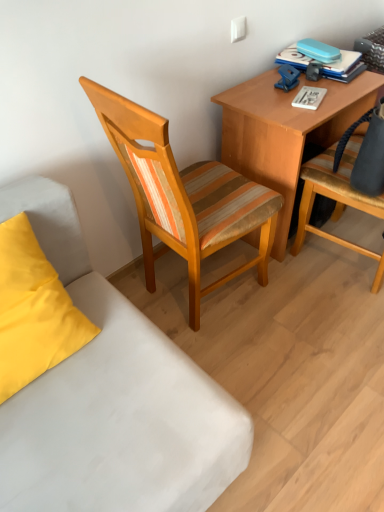
Identify the location of woodenchair at center, marked as the second chair in a right-to-left arrangement. (184, 196).

What do you see at coordinates (112, 398) in the screenshot? I see `white fabric couch at lower left` at bounding box center [112, 398].

Measure the distance between white fabric couch at lower left and camera.

white fabric couch at lower left and camera are 35.54 inches apart from each other.

What are the coordinates of `blue hardcover book at upper right` in the screenshot? It's located at (324, 64).

I want to click on matte yellow pillow at lower left, so click(x=33, y=311).

The height and width of the screenshot is (512, 384). What do you see at coordinates (286, 131) in the screenshot?
I see `wooden desk at upper right` at bounding box center [286, 131].

Where is `woodenchair at center, the first chair when ordered from left to right`? woodenchair at center, the first chair when ordered from left to right is located at coordinates (184, 196).

Choose the correct answer: Is matte yellow pillow at lower left inside wooden desk at upper right or outside it?

The correct answer is: outside.

Is wooden desk at upper right at the back of matte yellow pillow at lower left?

No, wooden desk at upper right is not at the back of matte yellow pillow at lower left.

Considering the relative sizes of matte yellow pillow at lower left and wooden desk at upper right in the image provided, is matte yellow pillow at lower left wider than wooden desk at upper right?

In fact, matte yellow pillow at lower left might be narrower than wooden desk at upper right.

Which of these two, blue hardcover book at upper right or white fabric couch at lower left, is thinner?

With smaller width is blue hardcover book at upper right.

Considering the positions of objects blue hardcover book at upper right and white fabric couch at lower left in the image provided, who is more to the right, blue hardcover book at upper right or white fabric couch at lower left?

blue hardcover book at upper right is more to the right.

Is blue hardcover book at upper right smaller than white fabric couch at lower left?

Indeed, blue hardcover book at upper right has a smaller size compared to white fabric couch at lower left.

How far apart are blue hardcover book at upper right and white fabric couch at lower left?

blue hardcover book at upper right is 1.42 meters away from white fabric couch at lower left.

Can you confirm if striped fabric chair at right, placed as the 2th chair when sorted from left to right, is wider than matte yellow pillow at lower left?

Indeed, striped fabric chair at right, placed as the 2th chair when sorted from left to right, has a greater width compared to matte yellow pillow at lower left.

Does point (341, 197) lie behind point (23, 225)?

Yes.

Does striped fabric chair at right, the first chair viewed from the right, appear on the right side of matte yellow pillow at lower left?

Yes, striped fabric chair at right, the first chair viewed from the right, is to the right of matte yellow pillow at lower left.

Between striped fabric chair at right, the first chair viewed from the right, and blue hardcover book at upper right, which one appears on the right side from the viewer's perspective?

striped fabric chair at right, the first chair viewed from the right.

Are striped fabric chair at right, the first chair viewed from the right, and blue hardcover book at upper right making contact?

There is a gap between striped fabric chair at right, the first chair viewed from the right, and blue hardcover book at upper right.

Considering the sizes of objects striped fabric chair at right, the first chair viewed from the right, and blue hardcover book at upper right in the image provided, who is smaller, striped fabric chair at right, the first chair viewed from the right, or blue hardcover book at upper right?

Smaller between the two is blue hardcover book at upper right.

Is the depth of striped fabric chair at right, placed as the 2th chair when sorted from left to right, greater than that of blue hardcover book at upper right?

No, it is in front of blue hardcover book at upper right.

Which is behind, point (272, 115) or point (6, 226)?

Point (272, 115)

Is wooden desk at upper right oriented towards matte yellow pillow at lower left?

No, wooden desk at upper right is not facing towards matte yellow pillow at lower left.

Is wooden desk at upper right at the left side of matte yellow pillow at lower left?

No, wooden desk at upper right is not to the left of matte yellow pillow at lower left.

How many degrees apart are the facing directions of wooden desk at upper right and matte yellow pillow at lower left?

They differ by 3.26 degrees in their facing directions.

You are a GUI agent. You are given a task and a screenshot of the screen. Output one action in this format:
    pyautogui.click(x=<x>, y=<y>)
    Task: Click on the studio couch below the blue hardcover book at upper right (from the image's perspective)
    This screenshot has width=384, height=512.
    Given the screenshot: What is the action you would take?
    pyautogui.click(x=112, y=398)

Is white fabric couch at lower left positioned with its back to blue hardcover book at upper right?

white fabric couch at lower left does not have its back to blue hardcover book at upper right.

Between white fabric couch at lower left and blue hardcover book at upper right, which one appears on the right side from the viewer's perspective?

From the viewer's perspective, blue hardcover book at upper right appears more on the right side.

Considering the relative positions of white fabric couch at lower left and blue hardcover book at upper right in the image provided, is white fabric couch at lower left in front of blue hardcover book at upper right?

Yes, it is in front of blue hardcover book at upper right.

From a real-world perspective, is blue hardcover book at upper right on woodenchair at center, marked as the second chair in a right-to-left arrangement?

Yes, from a real-world perspective, blue hardcover book at upper right is above woodenchair at center, marked as the second chair in a right-to-left arrangement.

Which object is thinner, blue hardcover book at upper right or woodenchair at center, the first chair when ordered from left to right?

Thinner between the two is blue hardcover book at upper right.

How many degrees apart are the facing directions of blue hardcover book at upper right and woodenchair at center, the first chair when ordered from left to right?

The angle between the facing direction of blue hardcover book at upper right and the facing direction of woodenchair at center, the first chair when ordered from left to right, is 79.7 degrees.

Can you confirm if blue hardcover book at upper right is bigger than woodenchair at center, the first chair when ordered from left to right?

Incorrect, blue hardcover book at upper right is not larger than woodenchair at center, the first chair when ordered from left to right.

Identify the location of pillow on the left of the wooden desk at upper right. (33, 311).

This screenshot has width=384, height=512. I want to click on book that is on the right side of white fabric couch at lower left, so click(x=324, y=64).

Estimate the real-world distances between objects in this image. Which object is closer to blue hardcover book at upper right, white fabric couch at lower left or striped fabric chair at right, placed as the 2th chair when sorted from left to right?

striped fabric chair at right, placed as the 2th chair when sorted from left to right, is closer to blue hardcover book at upper right.

Estimate the real-world distances between objects in this image. Which object is further from blue hardcover book at upper right, matte yellow pillow at lower left or wooden desk at upper right?

matte yellow pillow at lower left is positioned further to the anchor blue hardcover book at upper right.

From the picture: Considering their positions, is white fabric couch at lower left positioned closer to blue hardcover book at upper right than matte yellow pillow at lower left?

Among the two, white fabric couch at lower left is located nearer to blue hardcover book at upper right.

Looking at the image, which one is located closer to striped fabric chair at right, placed as the 2th chair when sorted from left to right, wooden desk at upper right or white fabric couch at lower left?

wooden desk at upper right is positioned closer to the anchor striped fabric chair at right, placed as the 2th chair when sorted from left to right.

Considering their positions, is striped fabric chair at right, the first chair viewed from the right, positioned closer to wooden desk at upper right than blue hardcover book at upper right?

Among the two, striped fabric chair at right, the first chair viewed from the right, is located nearer to wooden desk at upper right.

Estimate the real-world distances between objects in this image. Which object is further from wooden desk at upper right, striped fabric chair at right, the first chair viewed from the right, or woodenchair at center, marked as the second chair in a right-to-left arrangement?

The object further to wooden desk at upper right is woodenchair at center, marked as the second chair in a right-to-left arrangement.

From the image, which object appears to be farther from striped fabric chair at right, placed as the 2th chair when sorted from left to right, woodenchair at center, the first chair when ordered from left to right, or blue hardcover book at upper right?

woodenchair at center, the first chair when ordered from left to right, is positioned further to the anchor striped fabric chair at right, placed as the 2th chair when sorted from left to right.

From the image, which object appears to be farther from matte yellow pillow at lower left, striped fabric chair at right, placed as the 2th chair when sorted from left to right, or white fabric couch at lower left?

The object further to matte yellow pillow at lower left is striped fabric chair at right, placed as the 2th chair when sorted from left to right.

The height and width of the screenshot is (512, 384). I want to click on studio couch between woodenchair at center, the first chair when ordered from left to right, and striped fabric chair at right, placed as the 2th chair when sorted from left to right, from left to right, so click(112, 398).

At what (x,y) coordinates should I click in order to perform the action: click on chair between matte yellow pillow at lower left and white fabric couch at lower left from left to right. Please return your answer as a coordinate pair (x, y). Looking at the image, I should click on (184, 196).

Find the location of a particular element. The width and height of the screenshot is (384, 512). studio couch between matte yellow pillow at lower left and striped fabric chair at right, the first chair viewed from the right, from left to right is located at coordinates (112, 398).

Image resolution: width=384 pixels, height=512 pixels. In order to click on pillow between blue hardcover book at upper right and white fabric couch at lower left vertically in this screenshot , I will do `click(33, 311)`.